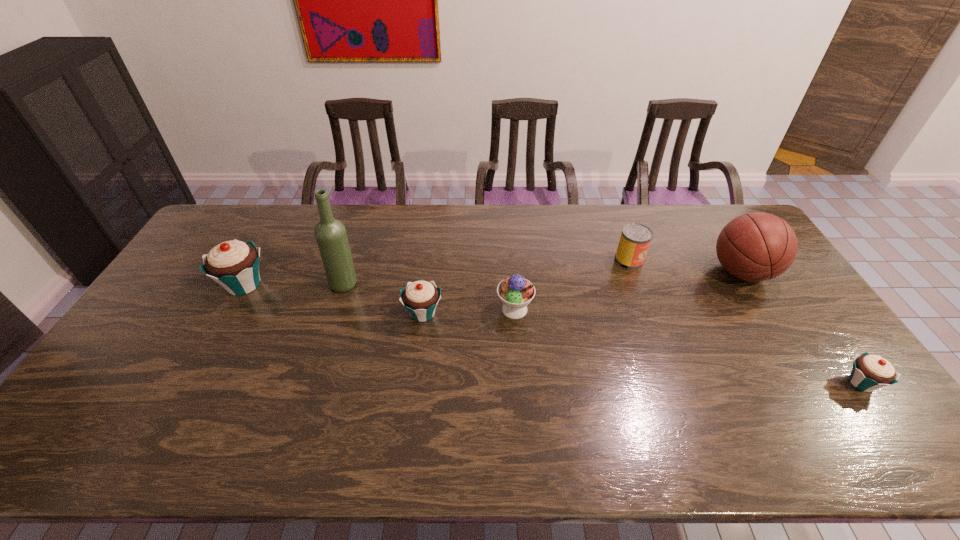
The image size is (960, 540). What are the coordinates of `icecream` in the screenshot? It's located at (515, 292).

The width and height of the screenshot is (960, 540). Find the location of `vacant space situated on the right of the fifth shortest object`. vacant space situated on the right of the fifth shortest object is located at coordinates (344, 285).

Find the location of a particular element. Image resolution: width=960 pixels, height=540 pixels. free space located 0.130m on the left of the second tallest cupcake is located at coordinates (359, 313).

This screenshot has width=960, height=540. I want to click on vacant space located 0.310m on the back of the rightmost cupcake, so click(791, 285).

At what (x,y) coordinates should I click in order to perform the action: click on vacant space located on the left of the can. Please return your answer as a coordinate pair (x, y). This screenshot has width=960, height=540. Looking at the image, I should click on point(588,260).

In order to click on free space located on the back of the second tallest object in this screenshot , I will do `click(720, 238)`.

You are a GUI agent. You are given a task and a screenshot of the screen. Output one action in this format:
    pyautogui.click(x=<x>, y=<y>)
    Task: Click on the free space located on the back of the second object from left to right
    This screenshot has height=540, width=960.
    Given the screenshot: What is the action you would take?
    pyautogui.click(x=363, y=226)

Where is `vacant space situated 0.070m on the front of the fourth object from right to left`? This screenshot has height=540, width=960. vacant space situated 0.070m on the front of the fourth object from right to left is located at coordinates (517, 343).

I want to click on object that is at the near edge, so click(870, 372).

This screenshot has height=540, width=960. In order to click on object located in the left edge section of the desktop in this screenshot , I will do `click(234, 264)`.